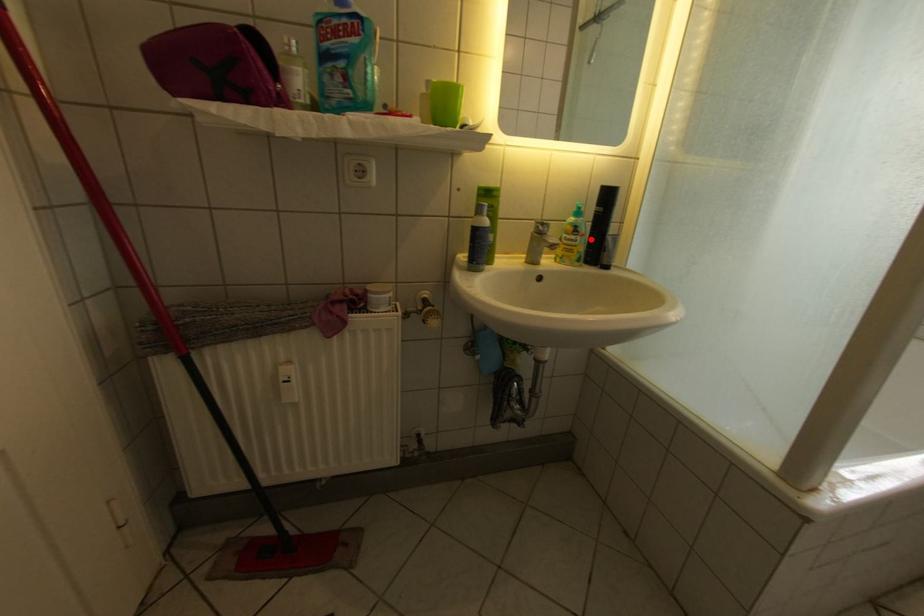
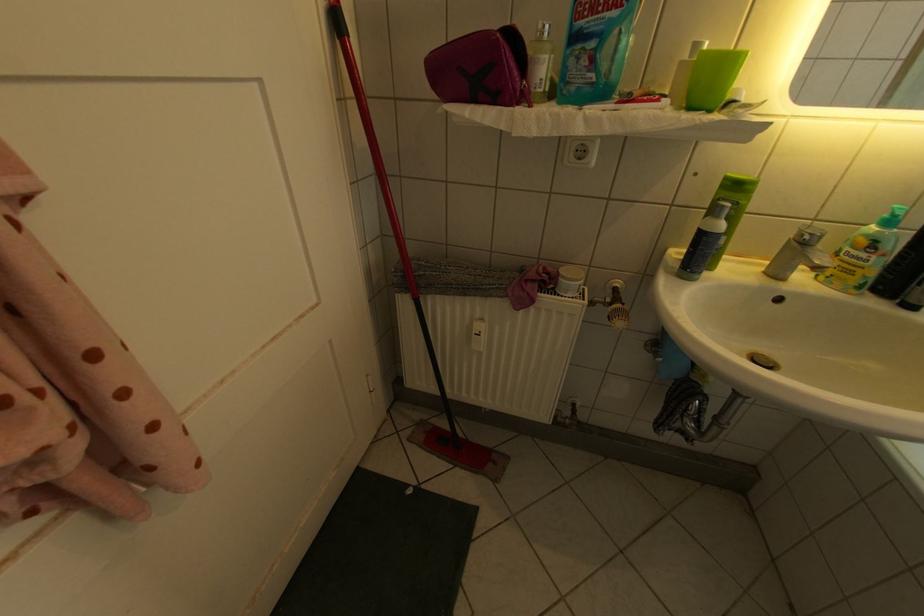
In the second image, find the point that corresponds to the highlighted location in the first image.

(888, 257)